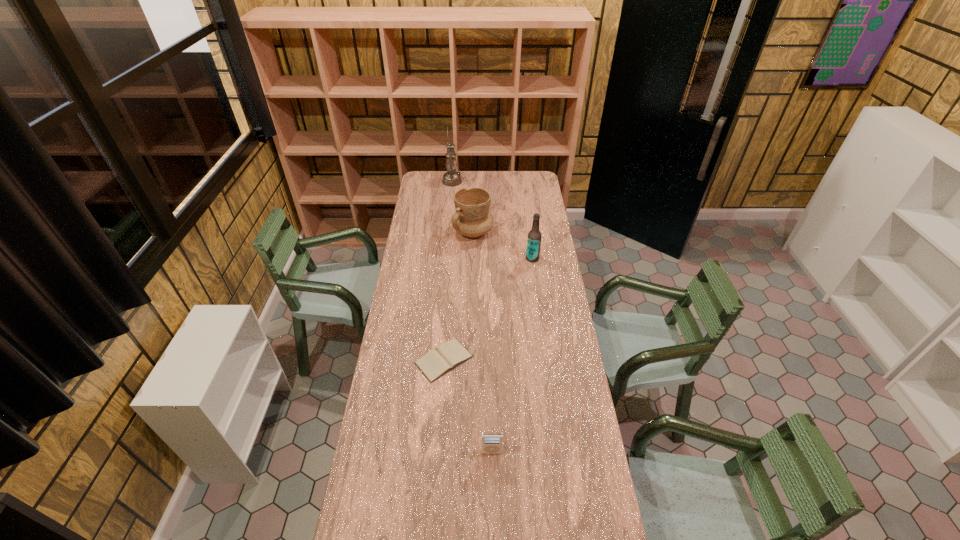
Identify which object is located as the third nearest to the beer bottle. Please provide its 2D coordinates. Your answer should be formatted as a tuple, i.e. [(x, y)], where the tuple contains the x and y coordinates of a point satisfying the conditions above.

[(451, 178)]

The width and height of the screenshot is (960, 540). Identify the location of free space that satisfies the following two spatial constraints: 1. on the label of the third nearest object; 2. on the front-facing side of the nearest object. (558, 452).

Where is `free region that satisfies the following two spatial constraints: 1. on the label of the rightmost object; 2. on the front-facing side of the fourth tallest object`? free region that satisfies the following two spatial constraints: 1. on the label of the rightmost object; 2. on the front-facing side of the fourth tallest object is located at coordinates (558, 452).

This screenshot has width=960, height=540. Identify the location of free location that satisfies the following two spatial constraints: 1. on the back side of the fourth nearest object; 2. on the right side of the Bible. (453, 232).

Find the location of a particular element. The height and width of the screenshot is (540, 960). free space that satisfies the following two spatial constraints: 1. on the label of the third farthest object; 2. on the front-facing side of the fourth tallest object is located at coordinates (558, 452).

Locate an element on the screen. vacant space that satisfies the following two spatial constraints: 1. on the label of the third farthest object; 2. on the front-facing side of the nearest object is located at coordinates (558, 452).